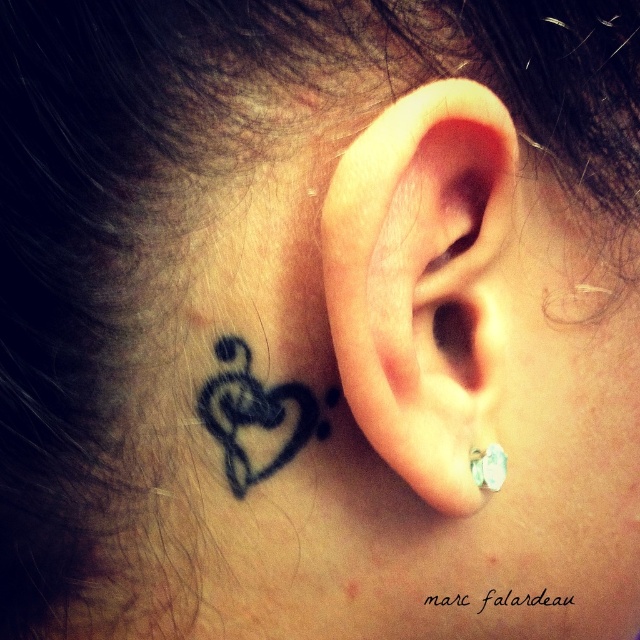
You are a photographer adjusting the focus on your camera. You want to ensure both the black ink heart at upper left and the silver metallic earring at ear are in focus. Given the depth of field, which object is closer to the camera lens?

The silver metallic earring at ear is closer to the camera lens because the black ink heart at upper left is 4.32 inches away from it. Since the earring is part of the subject and the heart is on the neck further away, adjusting focus on the earring will help both be in focus.

You are taking a photo with a camera and want to focus on the earring in the lower lobe of the ear. The camera can only focus on objects within 40 centimeters. Is the point at coordinates point (417,307) within the focus range?

Point (417,307) is 41.59 centimeters from the camera, which is beyond the 40 centimeter focus range. Therefore, the camera cannot focus on the earring in the lower lobe of the ear at this distance.

You are taking a photo of the ear and neck area shown in the image. You want to focus on the earring first, then shift focus to the tattoo. Which point should you focus on first, point (474, 337) or point (234, 410)?

You should focus on point (474, 337) first because it is closer to the camera than point (234, 410). After focusing on the earring, you can shift focus to point (234, 410) for the tattoo.